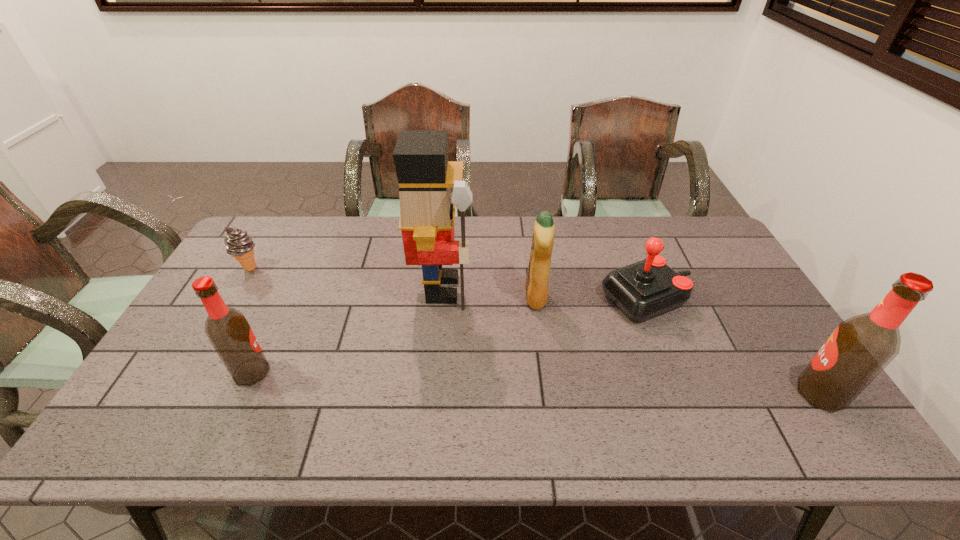
At what (x,y) coordinates should I click in order to perform the action: click on the shorter beer bottle. Please return your answer as a coordinate pair (x, y). The image size is (960, 540). Looking at the image, I should click on (229, 332).

Image resolution: width=960 pixels, height=540 pixels. In order to click on the second object from left to right in this screenshot , I will do `click(229, 332)`.

What are the coordinates of `the second tallest object` in the screenshot? It's located at (860, 348).

Locate an element on the screen. This screenshot has height=540, width=960. the rightmost object is located at coordinates (860, 348).

I want to click on nutcracker, so click(x=427, y=205).

I want to click on the tallest object, so click(427, 205).

Locate an element on the screen. Image resolution: width=960 pixels, height=540 pixels. the fifth tallest object is located at coordinates (642, 290).

Where is `joystick`? joystick is located at coordinates pos(642,290).

You are a GUI agent. You are given a task and a screenshot of the screen. Output one action in this format:
    pyautogui.click(x=<x>, y=<y>)
    Task: Click on the shortest object
    The width and height of the screenshot is (960, 540).
    Given the screenshot: What is the action you would take?
    pyautogui.click(x=239, y=244)

Find the location of a particular element. icecream is located at coordinates (239, 244).